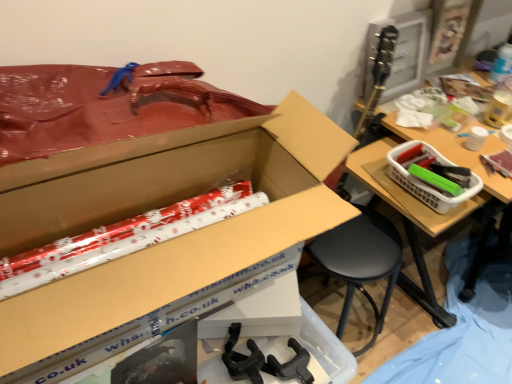
Question: From the image's perspective, is cardboard box at center under white plastic basket at right?

Choices:
 (A) yes
 (B) no

Answer: (A)

Question: Does cardboard box at center appear on the right side of white plastic basket at right?

Choices:
 (A) no
 (B) yes

Answer: (A)

Question: Is cardboard box at center aimed at white plastic basket at right?

Choices:
 (A) yes
 (B) no

Answer: (B)

Question: Does cardboard box at center have a lesser width compared to white plastic basket at right?

Choices:
 (A) yes
 (B) no

Answer: (B)

Question: Does cardboard box at center appear on the left side of white plastic basket at right?

Choices:
 (A) no
 (B) yes

Answer: (B)

Question: Is cardboard box at center outside of white plastic basket at right?

Choices:
 (A) no
 (B) yes

Answer: (B)

Question: From a real-world perspective, is white plastic basket at right on top of cardboard box at center?

Choices:
 (A) no
 (B) yes

Answer: (A)

Question: Is white plastic basket at right oriented towards cardboard box at center?

Choices:
 (A) yes
 (B) no

Answer: (B)

Question: From a real-world perspective, is white plastic basket at right beneath cardboard box at center?

Choices:
 (A) no
 (B) yes

Answer: (B)

Question: Is white plastic basket at right at the left side of cardboard box at center?

Choices:
 (A) yes
 (B) no

Answer: (B)

Question: From the image's perspective, is white plastic basket at right on top of cardboard box at center?

Choices:
 (A) yes
 (B) no

Answer: (A)

Question: Can you confirm if white plastic basket at right is smaller than cardboard box at center?

Choices:
 (A) yes
 (B) no

Answer: (A)

Question: Is cardboard box at center bigger or smaller than white plastic basket at right?

Choices:
 (A) big
 (B) small

Answer: (A)